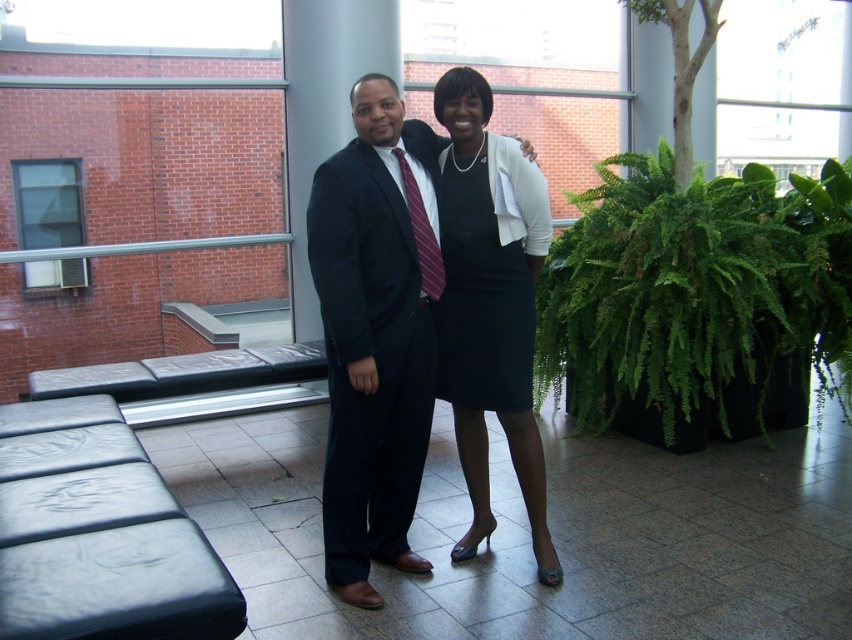
Question: Which point is farther to the camera?

Choices:
 (A) (758, 298)
 (B) (521, 342)
 (C) (450, 188)

Answer: (A)

Question: Among these objects, which one is farthest from the camera?

Choices:
 (A) green leafy plant at right
 (B) matte black suit at center
 (C) dark blue wool suit at center
 (D) black satin dress at center

Answer: (A)

Question: Is matte black suit at center bigger than dark blue wool suit at center?

Choices:
 (A) yes
 (B) no

Answer: (A)

Question: Can you confirm if dark blue wool suit at center is positioned below black satin dress at center?

Choices:
 (A) yes
 (B) no

Answer: (A)

Question: Is matte black suit at center positioned behind dark blue wool suit at center?

Choices:
 (A) yes
 (B) no

Answer: (B)

Question: Which of the following is the closest to the observer?

Choices:
 (A) (833, 358)
 (B) (458, 296)

Answer: (B)